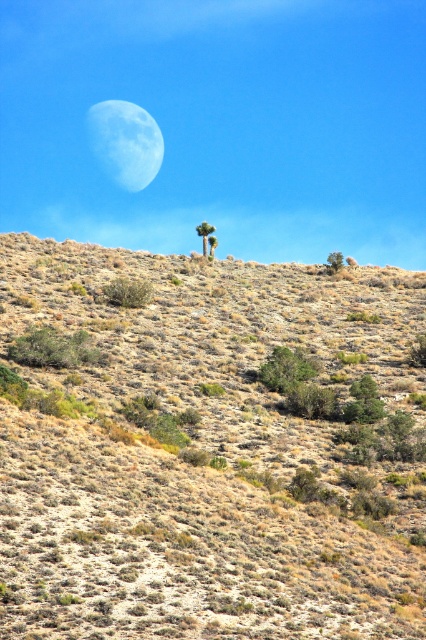
You are an astronaut stranded in a desert landscape. You see the dry shrubbery at center and the light blue textured moon at upper center. Which object is closer to the ground?

The dry shrubbery at center is closer to the ground as it is positioned below the light blue textured moon at upper center.

You are a hiker trying to navigate through the desert. You see the dry shrubbery at center and the light blue textured moon at upper center. Which object is located to the east if the moon is in the west?

The dry shrubbery at center is located to the east because it is to the right of the light blue textured moon at upper center, which is in the west.